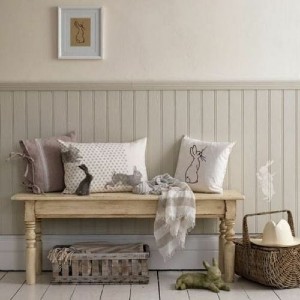
At what (x,y) coordinates should I click in order to perform the action: click on gray and white throw. Please return your answer as a coordinate pair (x, y). The width and height of the screenshot is (300, 300). Looking at the image, I should click on (164, 234).